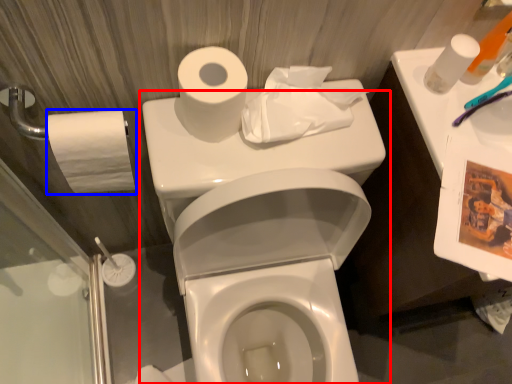
Question: Which point is closer to the camera, toilet (highlighted by a red box) or toilet paper (highlighted by a blue box)?

Choices:
 (A) toilet
 (B) toilet paper

Answer: (A)